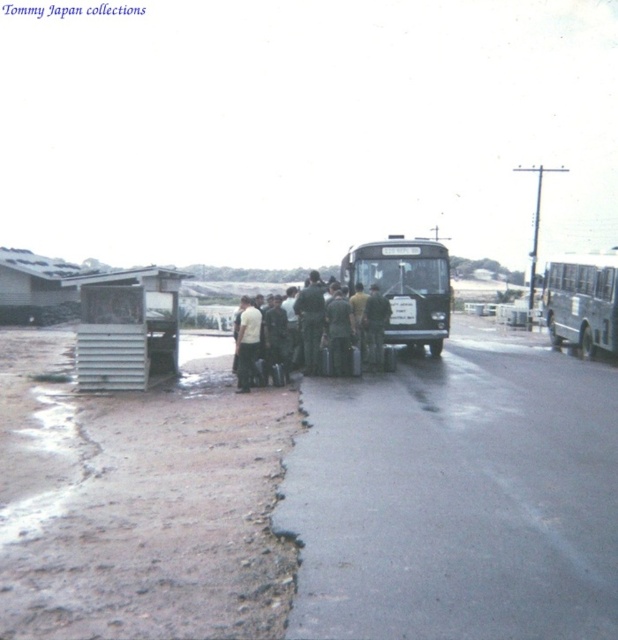
You are a pedestrian standing on the side of the road and see the black matte bus at center and the green fabric uniform at center. Which object is positioned more to the right from your perspective?

The black matte bus at center is to the right of the green fabric uniform at center, so the black matte bus at center is positioned more to the right.

You are a delivery person who needs to load a package onto the roof of the green matte bus at right. The package is 1.8 meters tall. Can you safely place it there without exceeding the height limit imposed by local regulations, which state that the total height of the load must not exceed the height of the green matte uniform at center?

The green matte bus at right has a greater height compared to the green matte uniform at center. Since the package is 1.8 meters tall, adding it to the bus roof would exceed the height of the bus itself, thus surpassing the regulation limit based on the uniform. Therefore, you cannot safely place the package there.